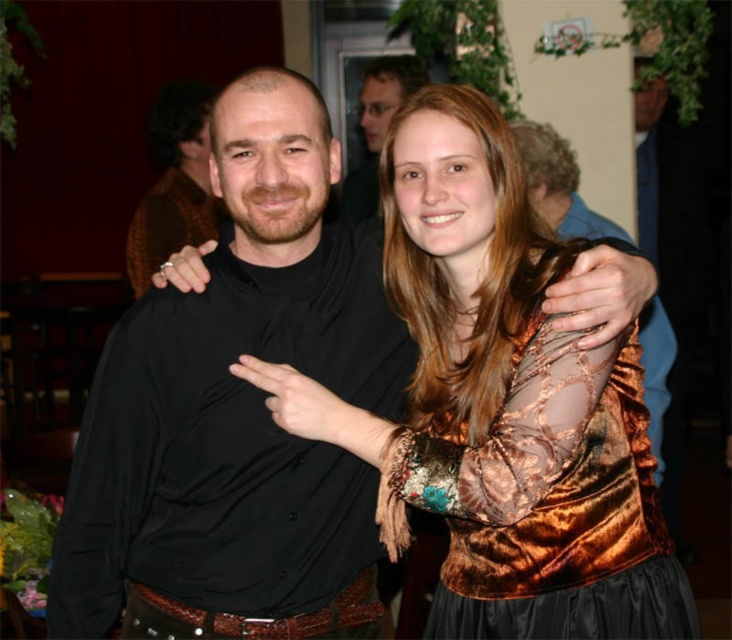
Question: Does velvet gold dress at center appear on the right side of matte black shirt at upper center?

Choices:
 (A) no
 (B) yes

Answer: (B)

Question: Can you confirm if velvet gold dress at center is positioned above velvet gold dress at upper right?

Choices:
 (A) yes
 (B) no

Answer: (A)

Question: Which point appears closest to the camera in this image?

Choices:
 (A) (315, 104)
 (B) (569, 522)

Answer: (B)

Question: Which point is closer to the camera taking this photo?

Choices:
 (A) (673, 586)
 (B) (329, 346)

Answer: (A)

Question: Is black satin shirt at center to the right of velvet gold dress at upper right from the viewer's perspective?

Choices:
 (A) yes
 (B) no

Answer: (B)

Question: Among these points, which one is farthest from the camera?

Choices:
 (A) (455, 484)
 (B) (542, 404)
 (C) (366, 67)
 (D) (93, 586)

Answer: (C)